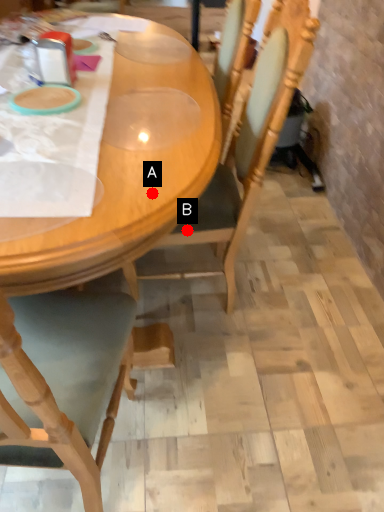
Question: Two points are circled on the image, labeled by A and B beside each circle. Which point is further to the camera?

Choices:
 (A) A is further
 (B) B is further

Answer: (B)